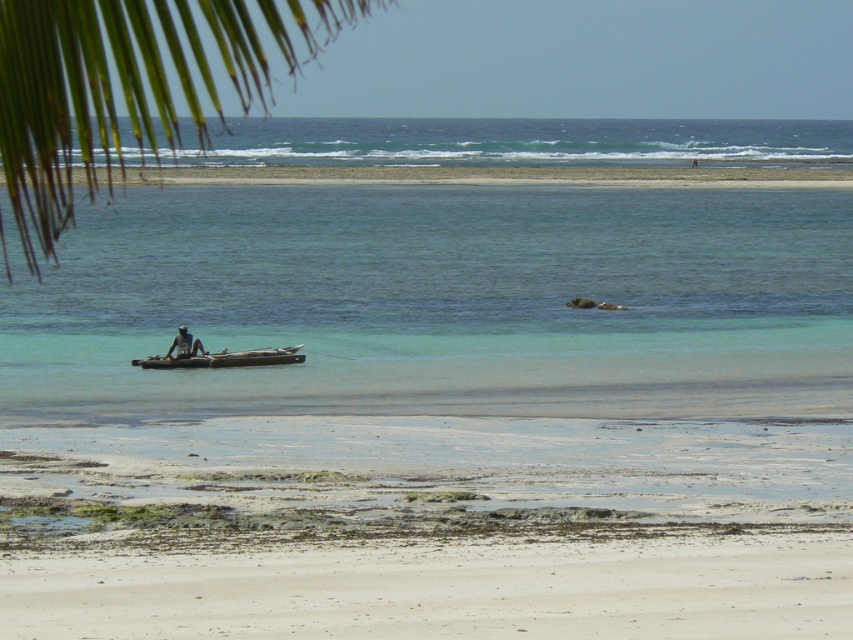
Does white sandy beach at lower center have a greater width compared to light brown wooden canoe at center?

Indeed, white sandy beach at lower center has a greater width compared to light brown wooden canoe at center.

Is white sandy beach at lower center below light brown wooden canoe at center?

Correct, white sandy beach at lower center is located below light brown wooden canoe at center.

At what (x,y) coordinates should I click in order to perform the action: click on white sandy beach at lower center. Please return your answer as a coordinate pair (x, y). The height and width of the screenshot is (640, 853). Looking at the image, I should click on (440, 589).

Can you confirm if green leafy palm tree at upper left is wider than light brown wooden canoe at center?

Indeed, green leafy palm tree at upper left has a greater width compared to light brown wooden canoe at center.

Identify the location of green leafy palm tree at upper left. The width and height of the screenshot is (853, 640). (132, 84).

Is green leafy palm tree at upper left to the left of wooden raft at center from the viewer's perspective?

Yes, green leafy palm tree at upper left is to the left of wooden raft at center.

Is green leafy palm tree at upper left closer to the viewer compared to wooden raft at center?

That is True.

The height and width of the screenshot is (640, 853). Describe the element at coordinates (132, 84) in the screenshot. I see `green leafy palm tree at upper left` at that location.

You are a GUI agent. You are given a task and a screenshot of the screen. Output one action in this format:
    pyautogui.click(x=<x>, y=<y>)
    Task: Click on the green leafy palm tree at upper left
    
    Given the screenshot: What is the action you would take?
    pyautogui.click(x=132, y=84)